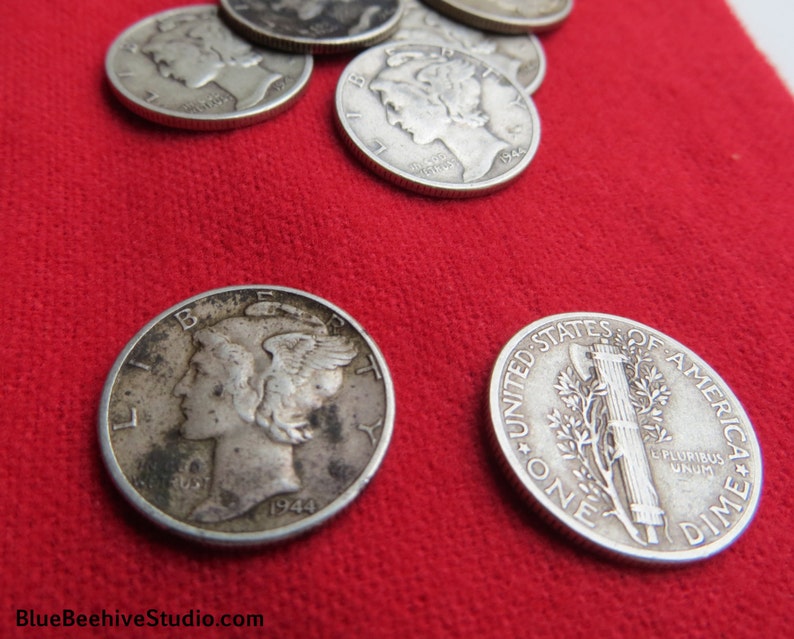
Identify the location of red fabric surface. (465, 291).